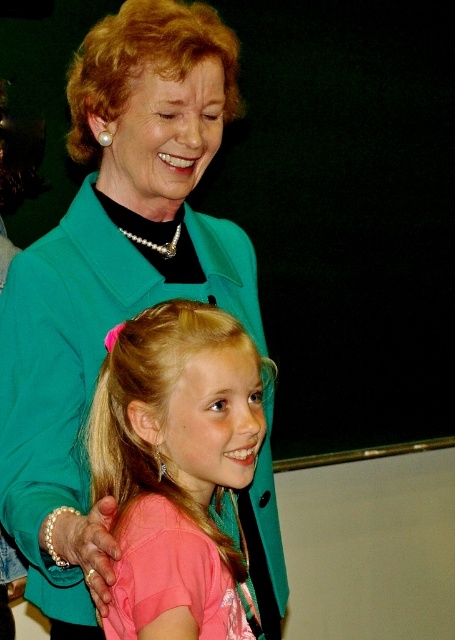
Does teal fabric jacket at upper left appear under pink satin dress at center?

No.

Is teal fabric jacket at upper left to the right of pink satin dress at center from the viewer's perspective?

Yes, teal fabric jacket at upper left is to the right of pink satin dress at center.

You are a GUI agent. You are given a task and a screenshot of the screen. Output one action in this format:
    pyautogui.click(x=<x>, y=<y>)
    Task: Click on the teal fabric jacket at upper left
    The width and height of the screenshot is (455, 640).
    Given the screenshot: What is the action you would take?
    [x=111, y=276]

Locate an element on the screen. This screenshot has height=640, width=455. teal fabric jacket at upper left is located at coordinates (111, 276).

Which is in front, point (84, 545) or point (94, 76)?

Point (84, 545) is in front.

Can you confirm if teal fabric jacket at upper left is bigger than blonde silky hair at upper left?

Indeed, teal fabric jacket at upper left has a larger size compared to blonde silky hair at upper left.

The width and height of the screenshot is (455, 640). What do you see at coordinates (111, 276) in the screenshot? I see `teal fabric jacket at upper left` at bounding box center [111, 276].

Where is `teal fabric jacket at upper left`? teal fabric jacket at upper left is located at coordinates (111, 276).

Does point (218, 632) come farther from viewer compared to point (192, 61)?

No.

Is pink satin dress at center smaller than blonde silky hair at upper left?

No.

Between point (185, 428) and point (129, 33), which one is positioned in front?

Point (185, 428) is more forward.

Locate an element on the screen. pink satin dress at center is located at coordinates (176, 467).